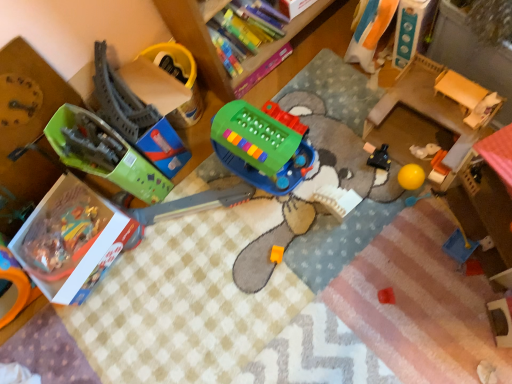
Where is `vacant space in front of gray plastic train tracks at left, the 5th toy positioned from the right`? The height and width of the screenshot is (384, 512). vacant space in front of gray plastic train tracks at left, the 5th toy positioned from the right is located at coordinates (195, 199).